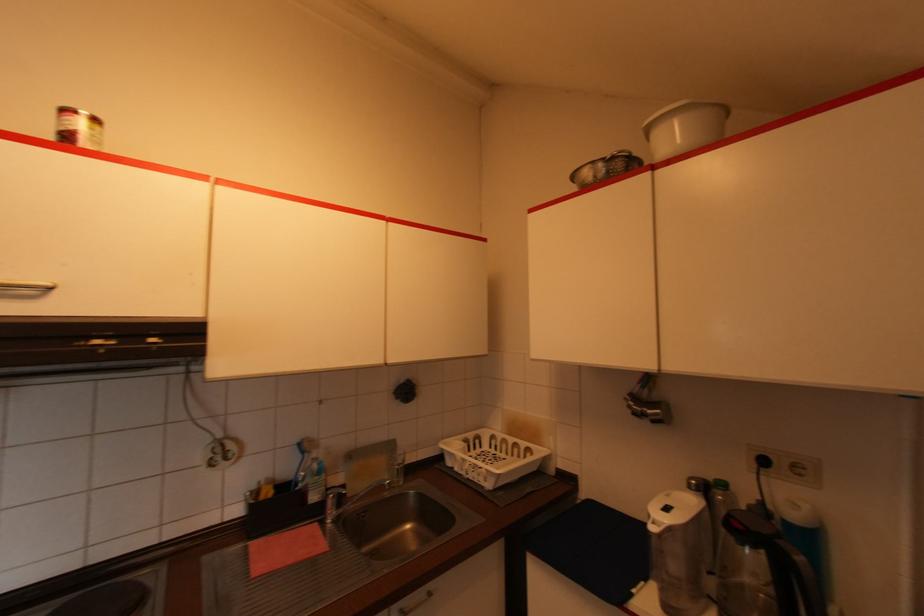
Find the location of a particular element. The width and height of the screenshot is (924, 616). faucet handle is located at coordinates (337, 488).